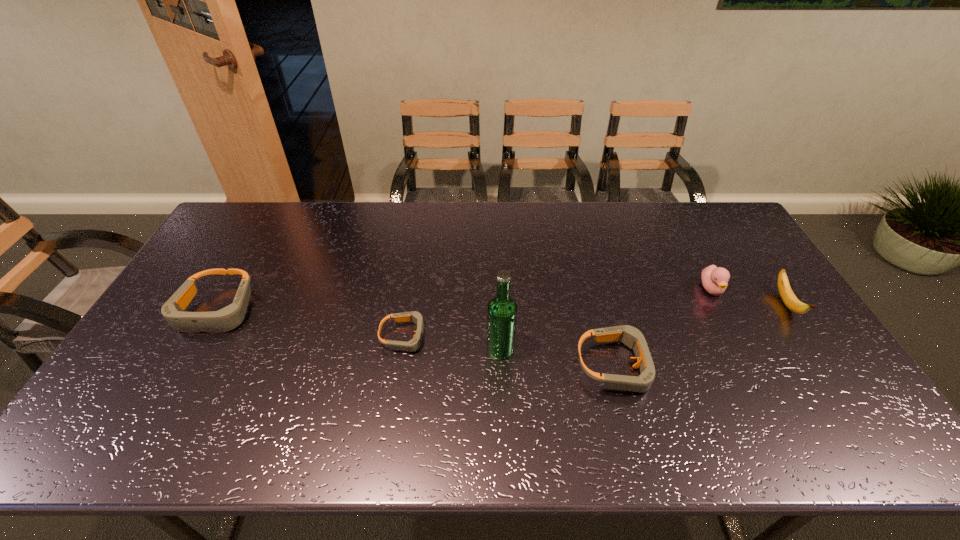
The image size is (960, 540). I want to click on the leftmost goggles, so tap(228, 318).

I want to click on the second goggles from left to right, so click(414, 344).

At what (x,y) coordinates should I click in order to perform the action: click on the shortest goggles. Please return your answer as a coordinate pair (x, y). This screenshot has height=540, width=960. Looking at the image, I should click on (414, 344).

This screenshot has width=960, height=540. What are the coordinates of `the second shortest goggles` in the screenshot? It's located at (633, 338).

Image resolution: width=960 pixels, height=540 pixels. In order to click on the fourth object from left to right in this screenshot , I will do `click(633, 338)`.

Image resolution: width=960 pixels, height=540 pixels. I want to click on the rightmost object, so pos(788,297).

Locate an element on the screen. duckling is located at coordinates tap(715, 280).

Where is `the tallest object`? the tallest object is located at coordinates (502, 309).

Find the location of a particular element. This screenshot has height=540, width=960. the third object from left to right is located at coordinates (502, 309).

Where is `free region located on the front and back of the leftmost goggles`? free region located on the front and back of the leftmost goggles is located at coordinates point(170,391).